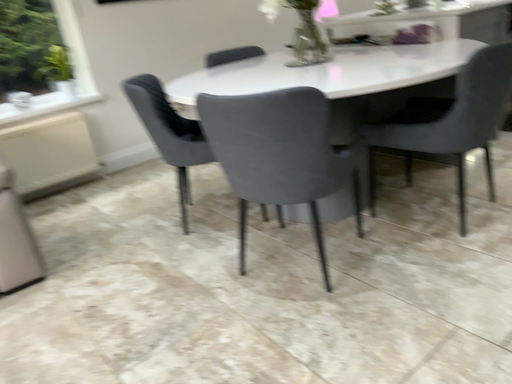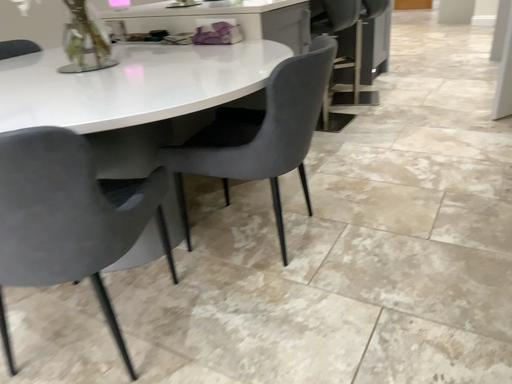
Question: How did the camera likely rotate when shooting the video?

Choices:
 (A) rotated right
 (B) rotated left

Answer: (A)